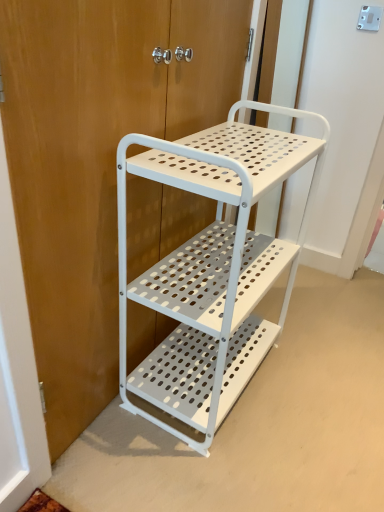
This screenshot has height=512, width=384. What are the coordinates of `free spot to the right of white perforated metal cart at center` in the screenshot? It's located at (316, 388).